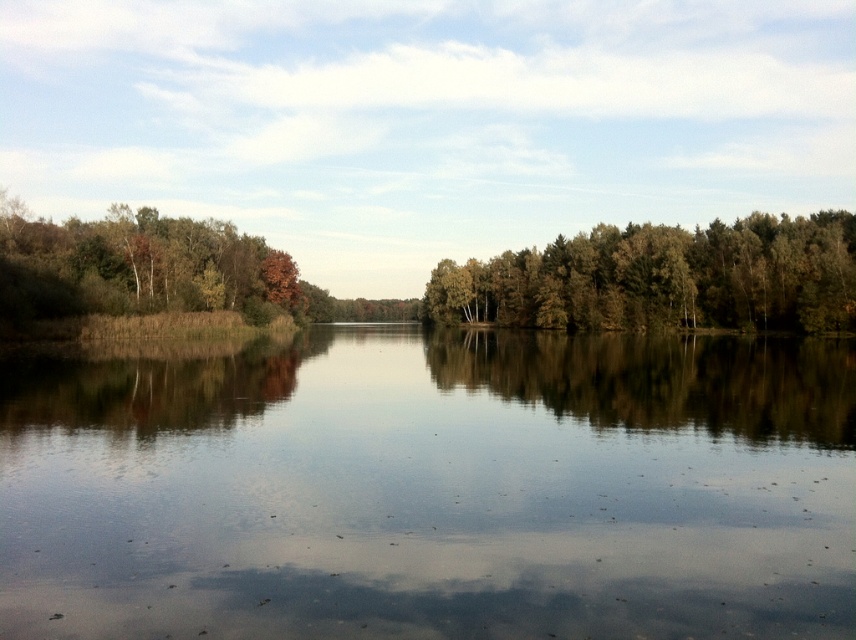
From the picture: You are standing at the edge of the lake and want to reach the smooth water at center. According to the coordinates provided, in which direction should you walk from your current position to reach it?

The smooth water at center is located at coordinates point (432, 490). Since you are at the edge, you should walk towards the center of the lake to reach it.